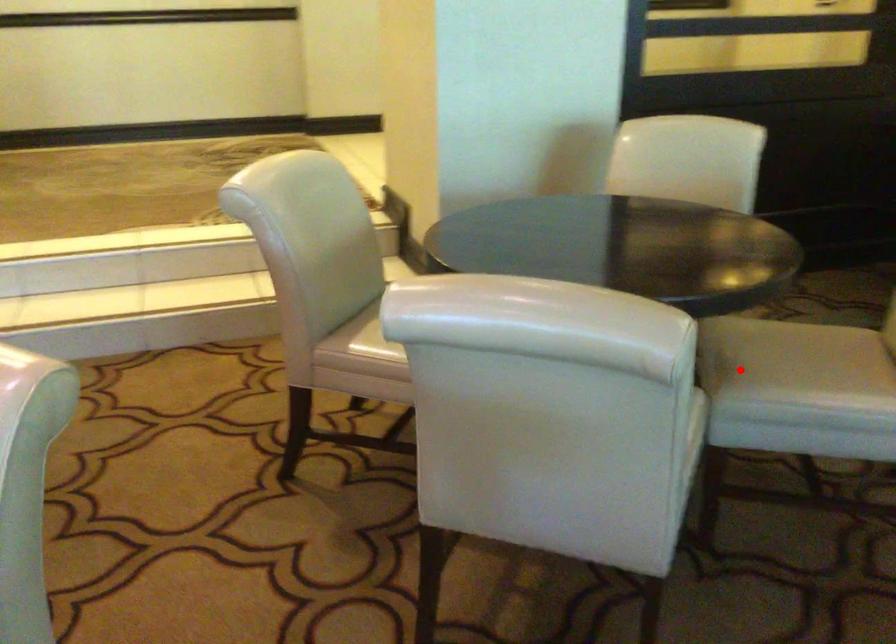
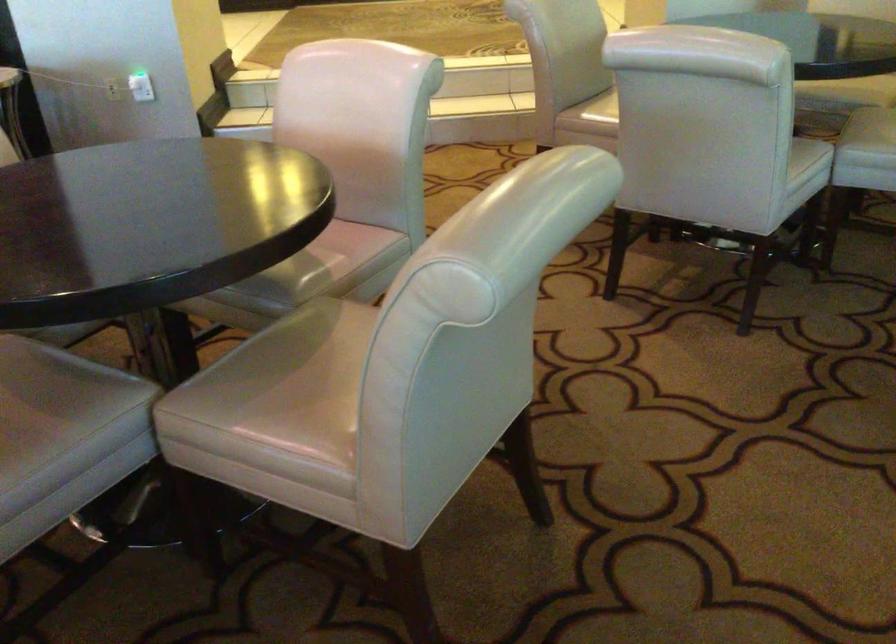
Locate, in the second image, the point that corresponds to the highlighted location in the first image.

(874, 125)